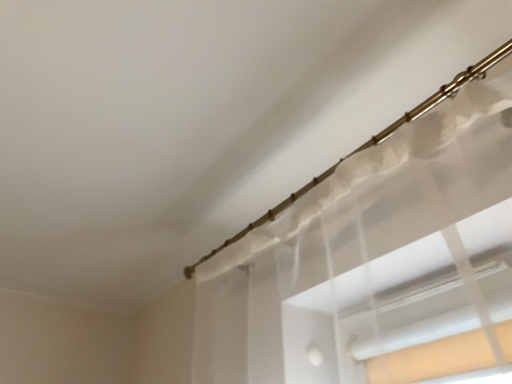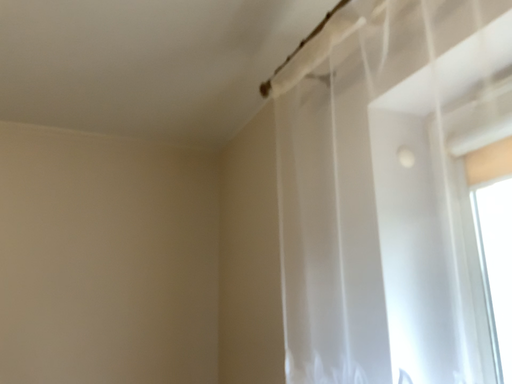
Question: Which way did the camera rotate in the video?

Choices:
 (A) rotated upward
 (B) rotated downward

Answer: (B)